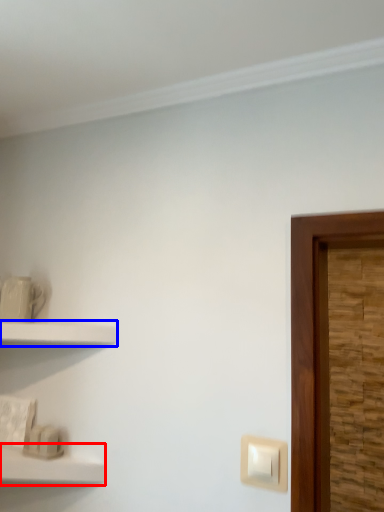
Question: Which object is closer to the camera taking this photo, shelf (highlighted by a red box) or shelf (highlighted by a blue box)?

Choices:
 (A) shelf
 (B) shelf

Answer: (A)